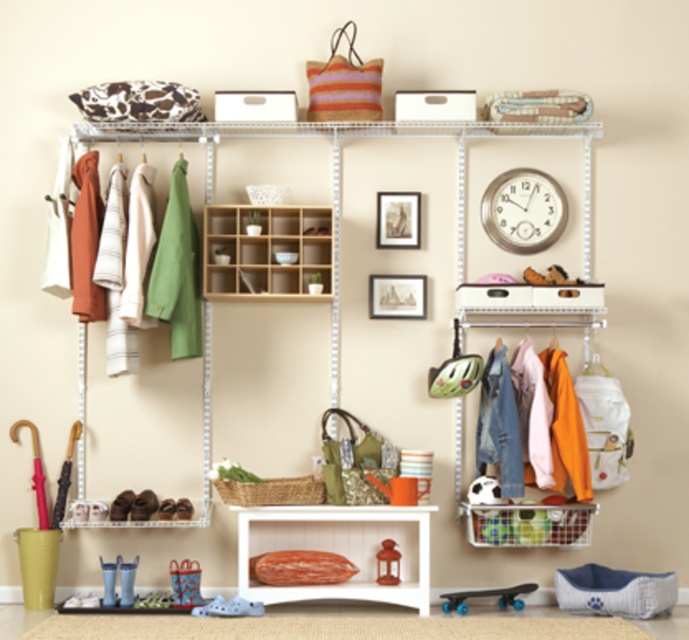
Is silver metallic clock at upper center shorter than blue rubber skateboard at lower center?

Incorrect, silver metallic clock at upper center's height does not fall short of blue rubber skateboard at lower center's.

Consider the image. Between silver metallic clock at upper center and blue rubber skateboard at lower center, which one has more height?

With more height is silver metallic clock at upper center.

Does point (539, 218) come in front of point (513, 602)?

No.

At what (x,y) coordinates should I click in order to perform the action: click on silver metallic clock at upper center. Please return your answer as a coordinate pair (x, y). The width and height of the screenshot is (689, 640). Looking at the image, I should click on (524, 211).

Can you confirm if wooden shelves at center is positioned to the left of blue rubber skateboard at lower center?

Correct, you'll find wooden shelves at center to the left of blue rubber skateboard at lower center.

Does wooden shelves at center appear on the right side of blue rubber skateboard at lower center?

No, wooden shelves at center is not to the right of blue rubber skateboard at lower center.

Image resolution: width=689 pixels, height=640 pixels. I want to click on wooden shelves at center, so click(x=265, y=252).

In order to click on wooden shelves at center in this screenshot , I will do `click(265, 252)`.

Who is more distant from viewer, [277,522] or [234,275]?

The point [234,275] is more distant.

Is the position of white wood shelf at center less distant than that of wooden shelves at center?

Yes, white wood shelf at center is closer to the viewer.

This screenshot has width=689, height=640. What do you see at coordinates (338, 548) in the screenshot? I see `white wood shelf at center` at bounding box center [338, 548].

Where is `white wood shelf at center`? This screenshot has width=689, height=640. white wood shelf at center is located at coordinates (338, 548).